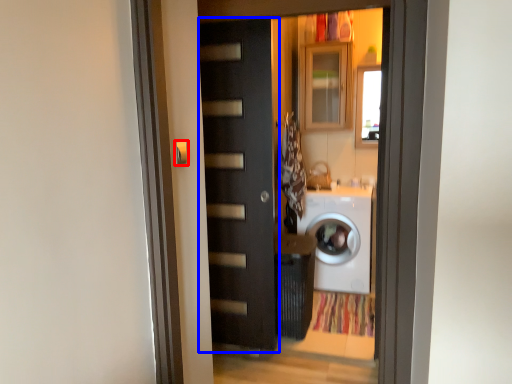
Question: Which object appears closest to the camera in this image, door handle (highlighted by a red box) or door (highlighted by a blue box)?

Choices:
 (A) door handle
 (B) door

Answer: (A)